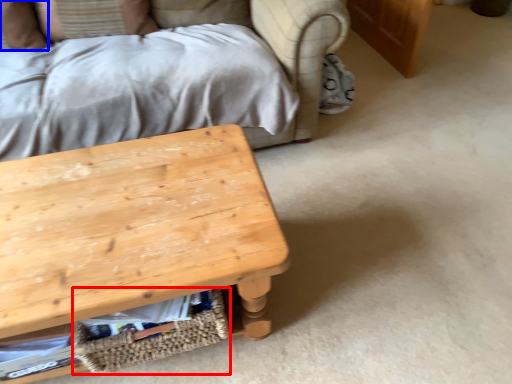
Question: Which point is further to the camera, basket (highlighted by a red box) or pillow (highlighted by a blue box)?

Choices:
 (A) basket
 (B) pillow

Answer: (B)